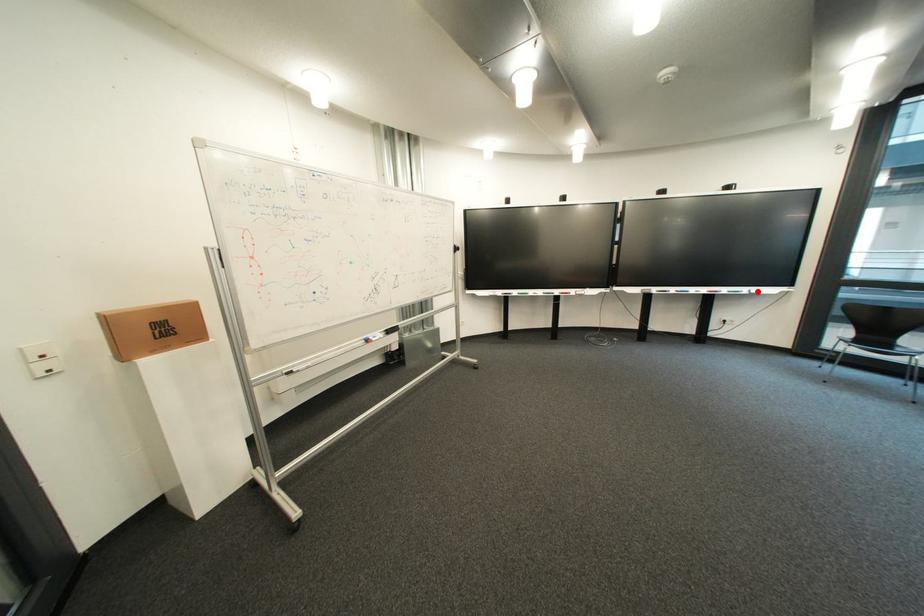
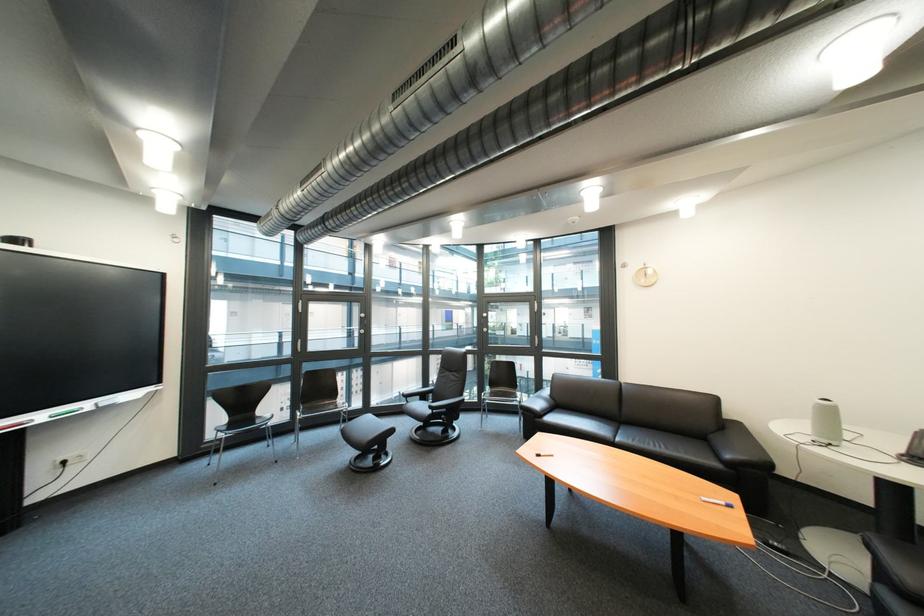
In the second image, find the point that corresponds to the highlighted location in the first image.

(101, 406)